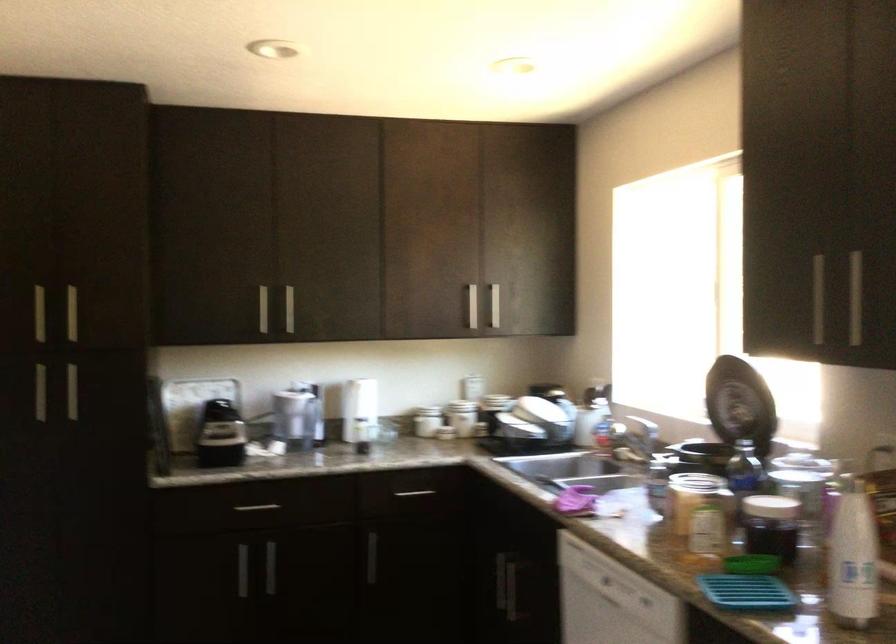
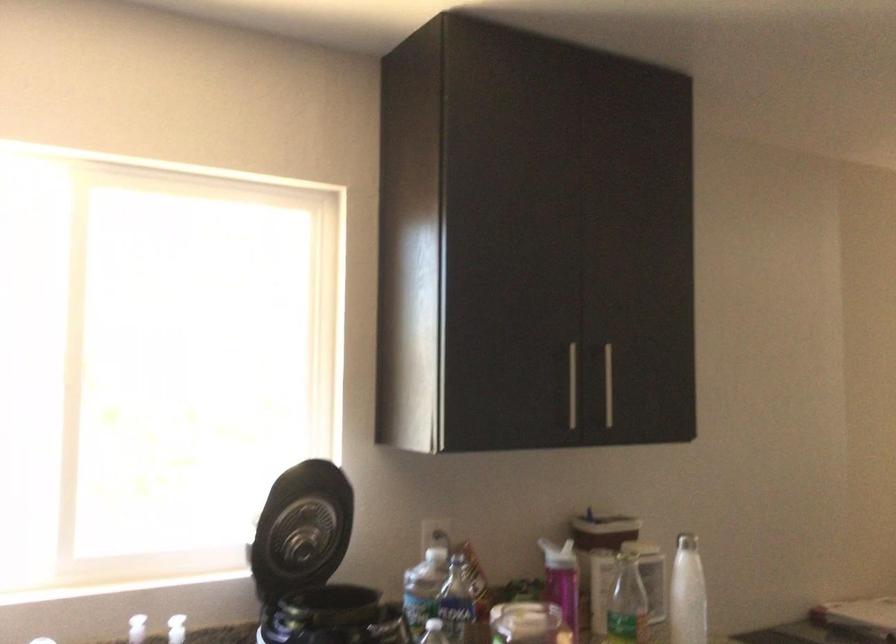
Locate, in the second image, the point that corresponds to (x=794, y=322) in the first image.

(572, 386)